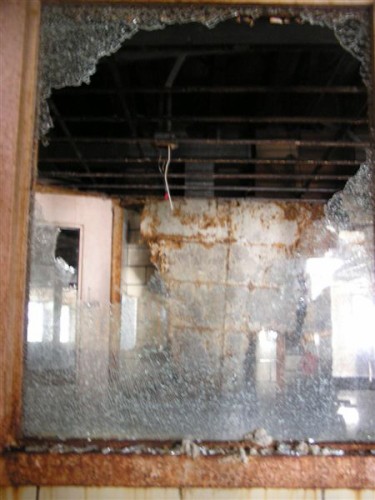
You are a GUI agent. You are given a task and a screenshot of the screen. Output one action in this format:
    pyautogui.click(x=<x>, y=<y>)
    Task: Click on the broken window
    The image size is (375, 500).
    Given the screenshot: What is the action you would take?
    pyautogui.click(x=44, y=285), pyautogui.click(x=41, y=396), pyautogui.click(x=175, y=405), pyautogui.click(x=337, y=405), pyautogui.click(x=339, y=316), pyautogui.click(x=349, y=259), pyautogui.click(x=211, y=254), pyautogui.click(x=213, y=329), pyautogui.click(x=121, y=322), pyautogui.click(x=355, y=214)